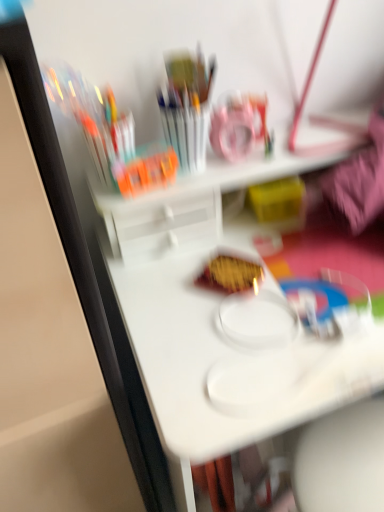
Question: From the image's perspective, would you say yellow matte snack at center is positioned over white plastic table at center?

Choices:
 (A) no
 (B) yes

Answer: (B)

Question: From a real-world perspective, is yellow matte snack at center over white plastic table at center?

Choices:
 (A) yes
 (B) no

Answer: (A)

Question: Considering the relative sizes of yellow matte snack at center and white plastic table at center in the image provided, is yellow matte snack at center thinner than white plastic table at center?

Choices:
 (A) no
 (B) yes

Answer: (B)

Question: Is yellow matte snack at center closer to camera compared to white plastic table at center?

Choices:
 (A) no
 (B) yes

Answer: (A)

Question: Is yellow matte snack at center outside of white plastic table at center?

Choices:
 (A) yes
 (B) no

Answer: (B)

Question: Is yellow matte snack at center to the left of white plastic table at center from the viewer's perspective?

Choices:
 (A) yes
 (B) no

Answer: (A)

Question: Considering the relative positions of white plastic table at center and yellow matte snack at center in the image provided, is white plastic table at center in front of yellow matte snack at center?

Choices:
 (A) yes
 (B) no

Answer: (A)

Question: Is white plastic table at center smaller than yellow matte snack at center?

Choices:
 (A) no
 (B) yes

Answer: (A)

Question: Is yellow matte snack at center located within white plastic table at center?

Choices:
 (A) yes
 (B) no

Answer: (A)

Question: Considering the relative sizes of white plastic table at center and yellow matte snack at center in the image provided, is white plastic table at center shorter than yellow matte snack at center?

Choices:
 (A) no
 (B) yes

Answer: (A)

Question: Is white plastic table at center at the left side of yellow matte snack at center?

Choices:
 (A) yes
 (B) no

Answer: (B)

Question: From a real-world perspective, is white plastic table at center positioned under yellow matte snack at center based on gravity?

Choices:
 (A) no
 (B) yes

Answer: (B)

Question: Considering the positions of yellow matte snack at center and white plastic table at center in the image, is yellow matte snack at center wider or thinner than white plastic table at center?

Choices:
 (A) wide
 (B) thin

Answer: (B)